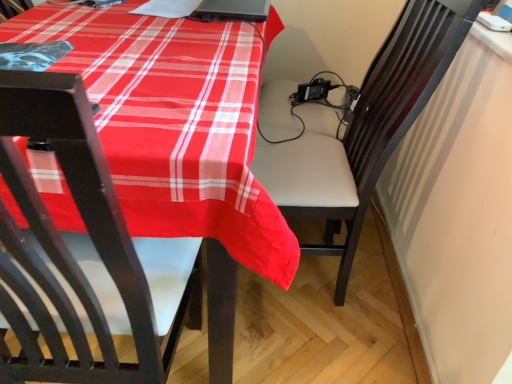
Question: Does black matte laptop at upper center have a greater height compared to white leather chair at center?

Choices:
 (A) no
 (B) yes

Answer: (A)

Question: Can you confirm if black matte laptop at upper center is shorter than white leather chair at center?

Choices:
 (A) no
 (B) yes

Answer: (B)

Question: From a real-world perspective, is black matte laptop at upper center positioned under white leather chair at center based on gravity?

Choices:
 (A) no
 (B) yes

Answer: (A)

Question: Does black matte laptop at upper center come in front of white leather chair at center?

Choices:
 (A) no
 (B) yes

Answer: (A)

Question: Is black matte laptop at upper center turned away from white leather chair at center?

Choices:
 (A) no
 (B) yes

Answer: (A)

Question: Is black matte laptop at upper center beside white leather chair at center?

Choices:
 (A) yes
 (B) no

Answer: (B)

Question: Is black matte laptop at upper center at the back of white leather chair at center?

Choices:
 (A) no
 (B) yes

Answer: (A)

Question: Would you say white leather chair at center is outside black matte laptop at upper center?

Choices:
 (A) yes
 (B) no

Answer: (A)

Question: From the image's perspective, does white leather chair at center appear lower than black matte laptop at upper center?

Choices:
 (A) yes
 (B) no

Answer: (A)

Question: Is white leather chair at center further to the viewer compared to black matte laptop at upper center?

Choices:
 (A) no
 (B) yes

Answer: (A)

Question: Is white leather chair at center facing towards black matte laptop at upper center?

Choices:
 (A) yes
 (B) no

Answer: (B)

Question: Can you confirm if white leather chair at center is shorter than black matte laptop at upper center?

Choices:
 (A) no
 (B) yes

Answer: (A)

Question: In the image, is white leather chair at center on the left side or the right side of black matte laptop at upper center?

Choices:
 (A) left
 (B) right

Answer: (B)